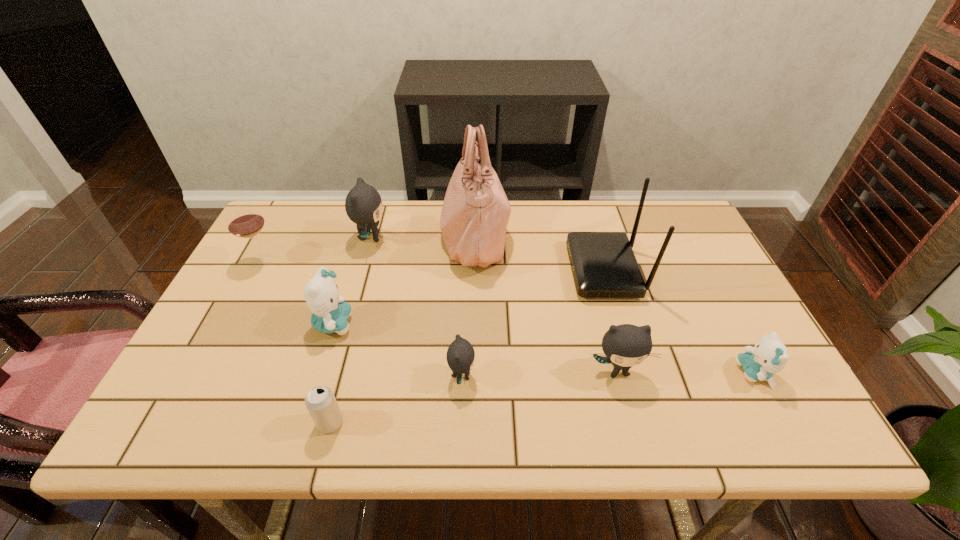
The image size is (960, 540). Identify the location of the tallest object. (475, 213).

Where is `the second tallest object`? the second tallest object is located at coordinates (603, 264).

Image resolution: width=960 pixels, height=540 pixels. In order to click on the farthest gray kitten in this screenshot , I will do (363, 205).

The width and height of the screenshot is (960, 540). Find the location of `the farthest kitten`. the farthest kitten is located at coordinates (363, 205).

At what (x,y) coordinates should I click in order to perform the action: click on red wineglass. Please return your answer as a coordinate pair (x, y). This screenshot has height=540, width=960. Looking at the image, I should click on (245, 221).

The width and height of the screenshot is (960, 540). Find the location of `the leftmost object`. the leftmost object is located at coordinates (245, 221).

Locate an element on the screen. This screenshot has height=540, width=960. the farther blue kitten is located at coordinates [330, 314].

Find the location of `the second farthest kitten`. the second farthest kitten is located at coordinates (330, 314).

Locate an element on the screen. The height and width of the screenshot is (540, 960). the rightmost gray kitten is located at coordinates (626, 345).

Locate an element on the screen. This screenshot has height=540, width=960. the second smallest gray kitten is located at coordinates (626, 345).